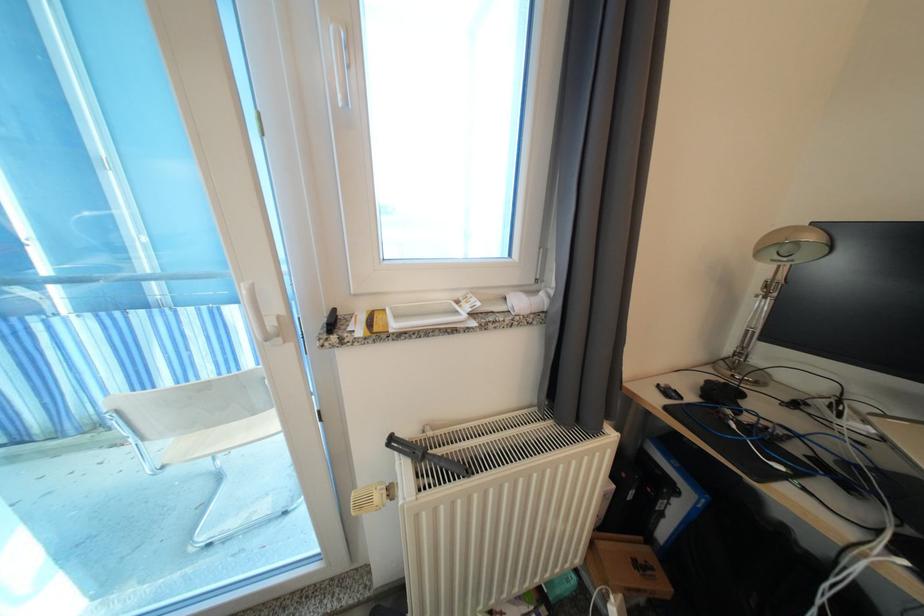
Locate an element on the screen. The height and width of the screenshot is (616, 924). radiator control knob is located at coordinates (368, 499).